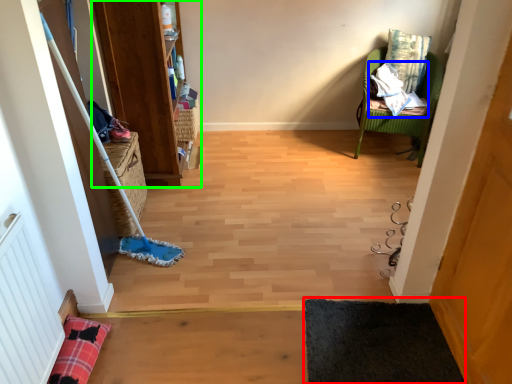
Question: Which object is positioned closest to yoga mat (highlighted by a red box)? Select from material (highlighted by a blue box) and bookshelf (highlighted by a green box).

Choices:
 (A) material
 (B) bookshelf

Answer: (B)